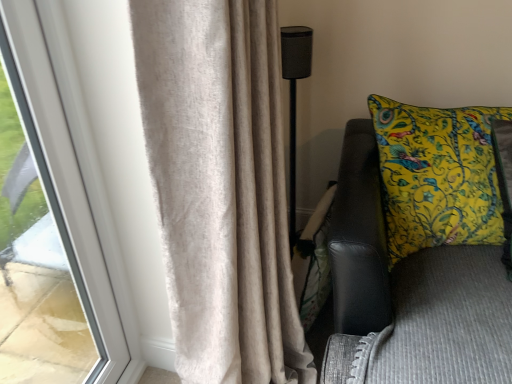
Question: From the image's perspective, is yellow printed cushion at right under black mesh speaker at center?

Choices:
 (A) yes
 (B) no

Answer: (A)

Question: Is yellow printed cushion at right wider than black mesh speaker at center?

Choices:
 (A) yes
 (B) no

Answer: (A)

Question: Is yellow printed cushion at right closer to the viewer compared to black mesh speaker at center?

Choices:
 (A) yes
 (B) no

Answer: (A)

Question: Does yellow printed cushion at right appear on the right side of black mesh speaker at center?

Choices:
 (A) yes
 (B) no

Answer: (A)

Question: Is yellow printed cushion at right not within black mesh speaker at center?

Choices:
 (A) no
 (B) yes

Answer: (B)

Question: Is black mesh speaker at center a part of yellow printed cushion at right?

Choices:
 (A) yes
 (B) no

Answer: (B)

Question: Is black mesh speaker at center bigger than beige textured curtain at left?

Choices:
 (A) yes
 (B) no

Answer: (B)

Question: Is black mesh speaker at center turned away from beige textured curtain at left?

Choices:
 (A) yes
 (B) no

Answer: (B)

Question: Are black mesh speaker at center and beige textured curtain at left far apart?

Choices:
 (A) no
 (B) yes

Answer: (A)

Question: Is the position of black mesh speaker at center more distant than that of beige textured curtain at left?

Choices:
 (A) yes
 (B) no

Answer: (A)

Question: Is beige textured curtain at left located within black mesh speaker at center?

Choices:
 (A) no
 (B) yes

Answer: (A)

Question: Does black mesh speaker at center have a greater height compared to beige textured curtain at left?

Choices:
 (A) yes
 (B) no

Answer: (B)

Question: Does yellow printed cushion at right have a lesser width compared to beige textured curtain at left?

Choices:
 (A) no
 (B) yes

Answer: (B)